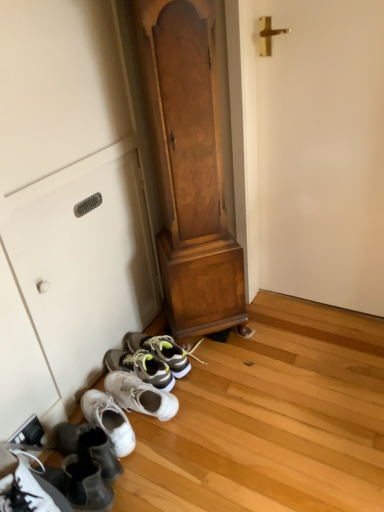
Locate an element on the screen. This screenshot has width=384, height=512. free space in front of white matte door at right is located at coordinates (323, 364).